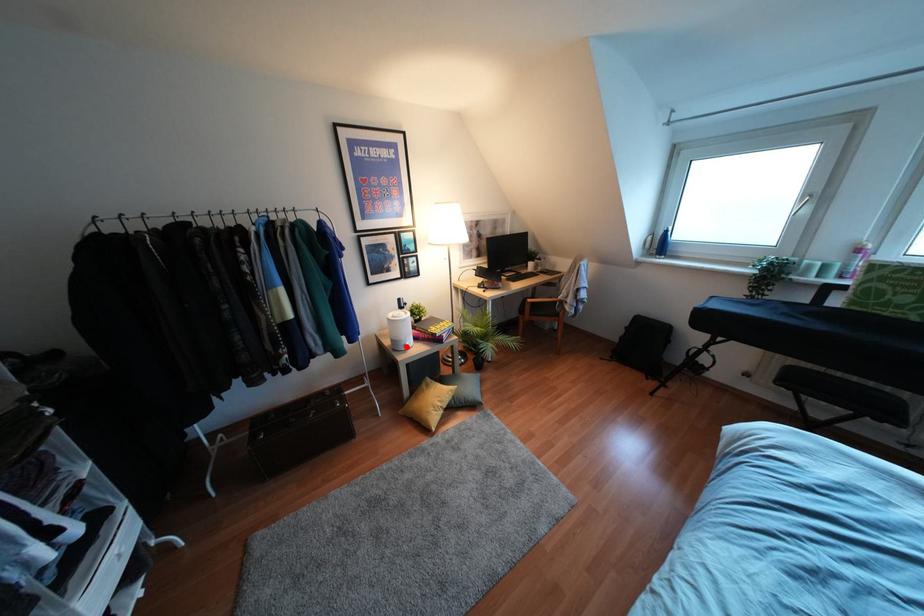
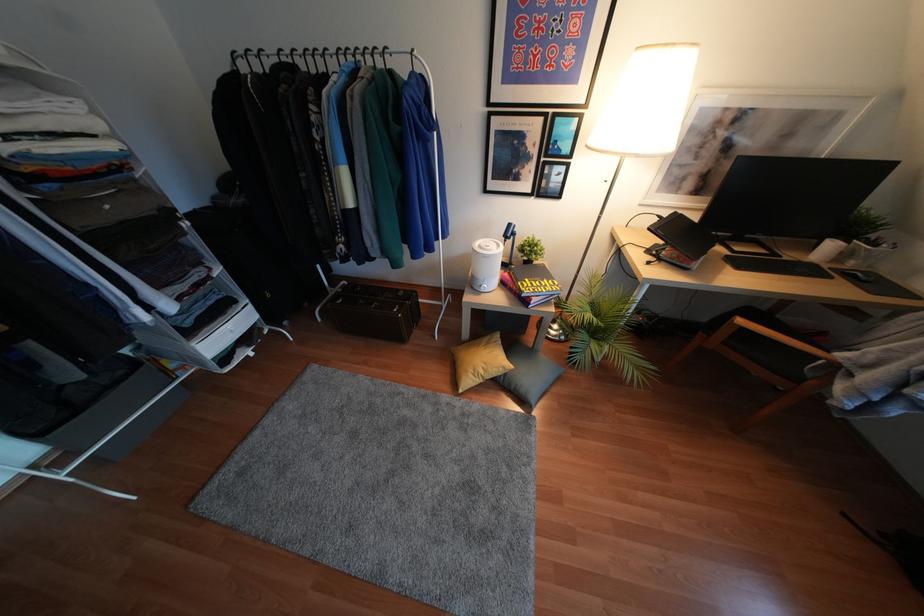
Locate, in the second image, the point that corresponds to the highlighted location in the first image.

(481, 290)